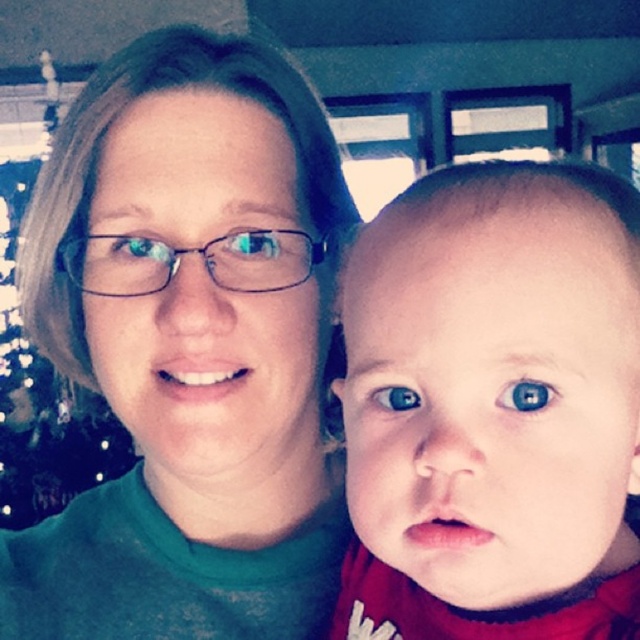
Can you confirm if green matte shirt at center is positioned to the right of smooth skin baby at center?

In fact, green matte shirt at center is to the left of smooth skin baby at center.

Is green matte shirt at center positioned before smooth skin baby at center?

No, it is not.

At what (x,y) coordinates should I click in order to perform the action: click on green matte shirt at center. Please return your answer as a coordinate pair (x, y). Looking at the image, I should click on (188, 348).

Find the location of a particular element. This screenshot has width=640, height=640. green matte shirt at center is located at coordinates (188, 348).